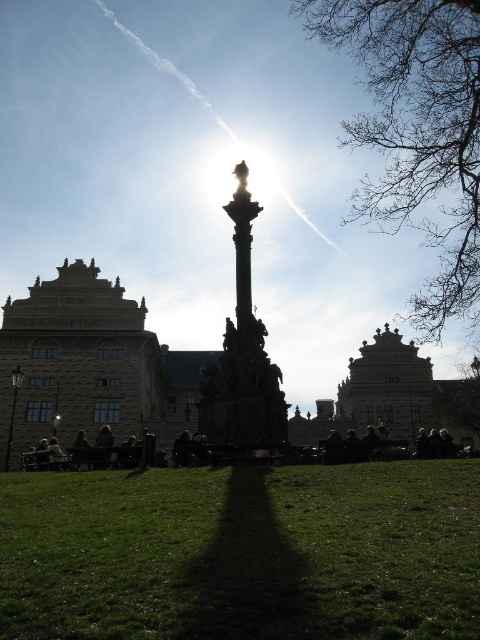
Question: Which point is closer to the camera taking this photo?

Choices:
 (A) (462, 609)
 (B) (395, 422)

Answer: (A)

Question: Does dark brown stone tower at left appear over dark brown leather jacket at lower left?

Choices:
 (A) no
 (B) yes

Answer: (B)

Question: Which point appears farthest from the camera in this image?

Choices:
 (A) pyautogui.click(x=94, y=456)
 (B) pyautogui.click(x=238, y=490)
 (C) pyautogui.click(x=84, y=337)

Answer: (C)

Question: Among these objects, which one is farthest from the camera?

Choices:
 (A) dark brown leather jacket at lower left
 (B) stone carved tower at center

Answer: (B)

Question: Can you confirm if green grass at center is positioned below stone carved tower at center?

Choices:
 (A) no
 (B) yes

Answer: (B)

Question: Can you confirm if green grass at center is positioned above dark brown stone tower at left?

Choices:
 (A) no
 (B) yes

Answer: (A)